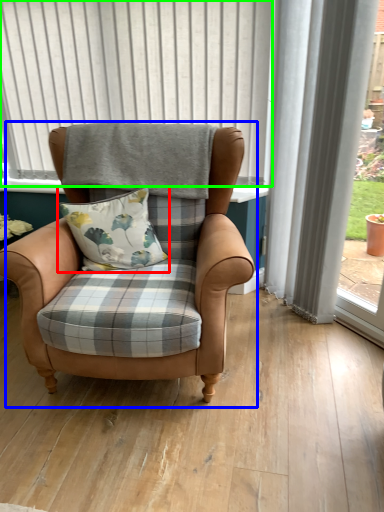
Question: Which object is the farthest from pillow (highlighted by a red box)? Choose among these: chair (highlighted by a blue box) or bay window (highlighted by a green box).

Choices:
 (A) chair
 (B) bay window

Answer: (B)